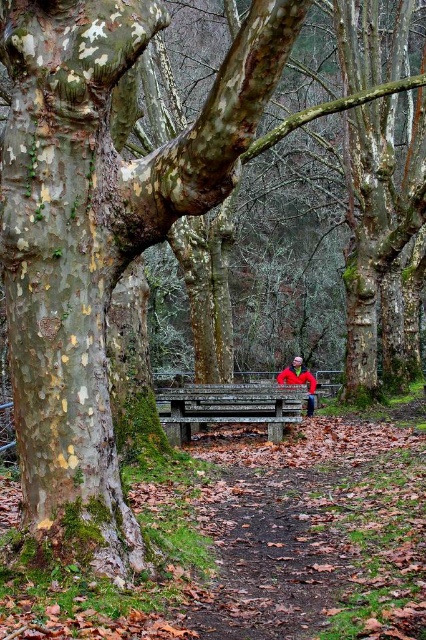
You are a hiker who just finished a long trek and wants to rest. You see a wooden bench at center and a red jacket at center. Which object is shorter?

The wooden bench at center is shorter than the red jacket at center.